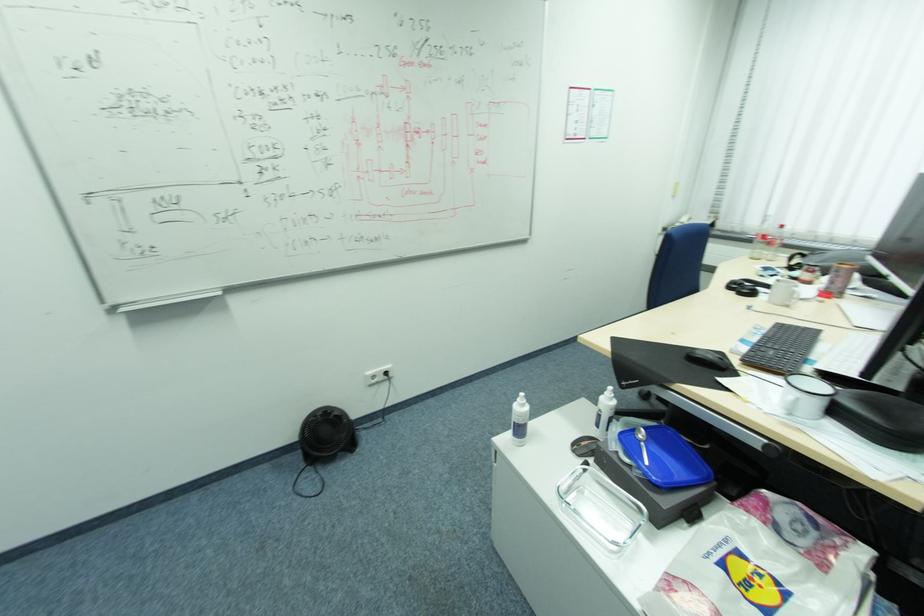
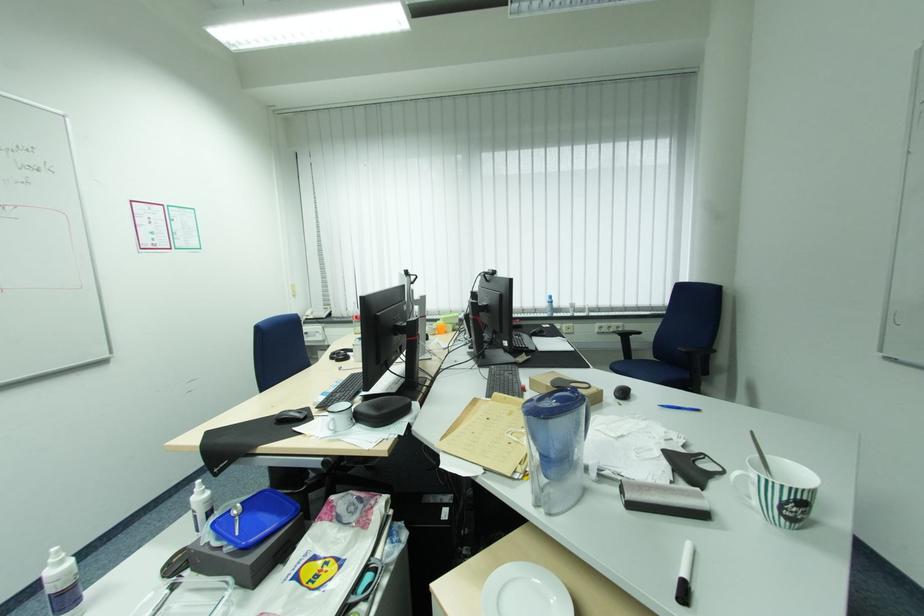
In the second image, find the point that corresponds to (699,355) in the first image.

(286, 418)